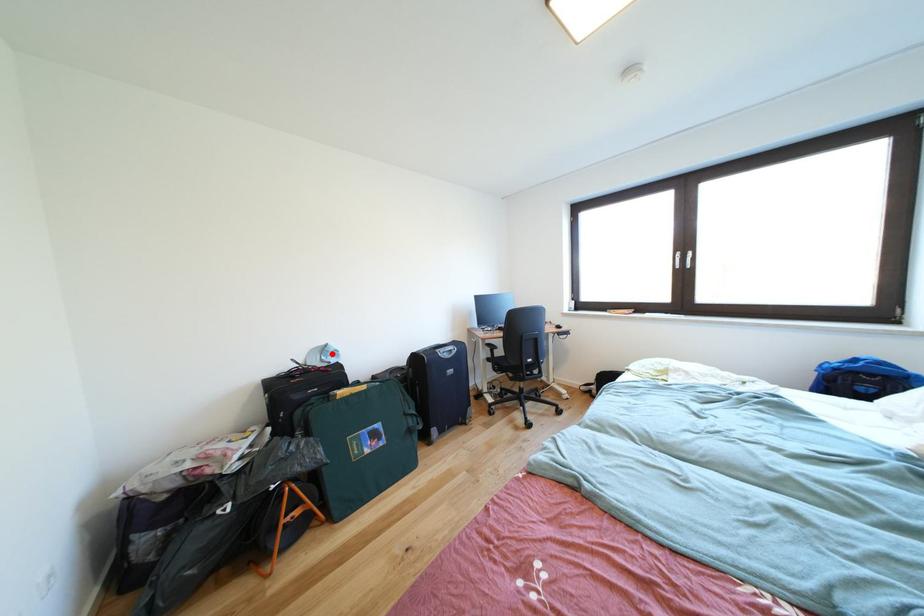
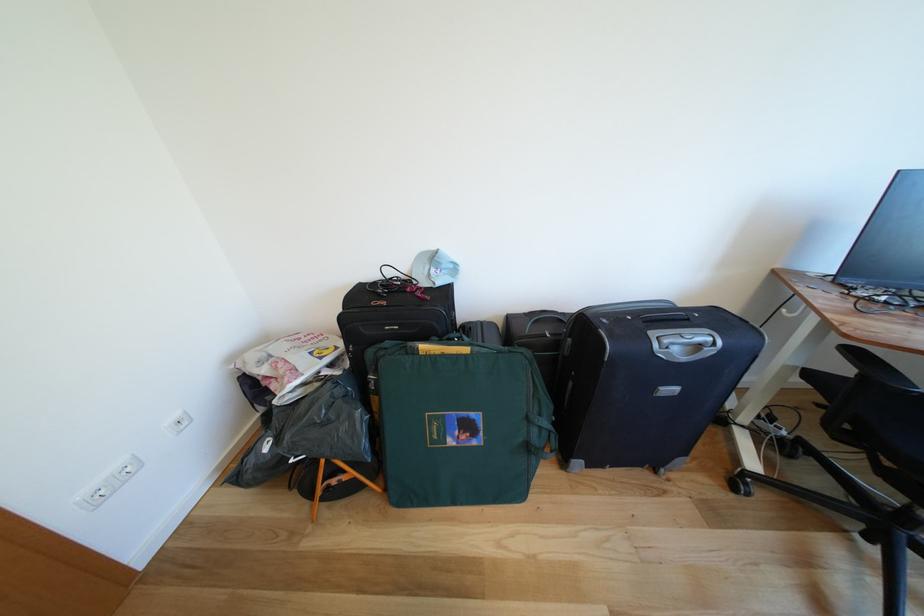
The point at the highlighted location is marked in the first image. Where is the corresponding point in the second image?

(442, 262)